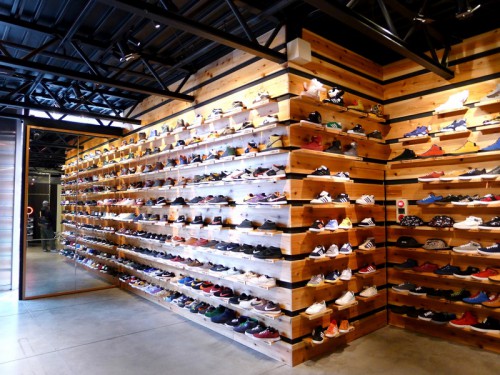
Where is `ceiling horizontal supports`? ceiling horizontal supports is located at coordinates (110, 118), (148, 94), (244, 45), (368, 29), (12, 114).